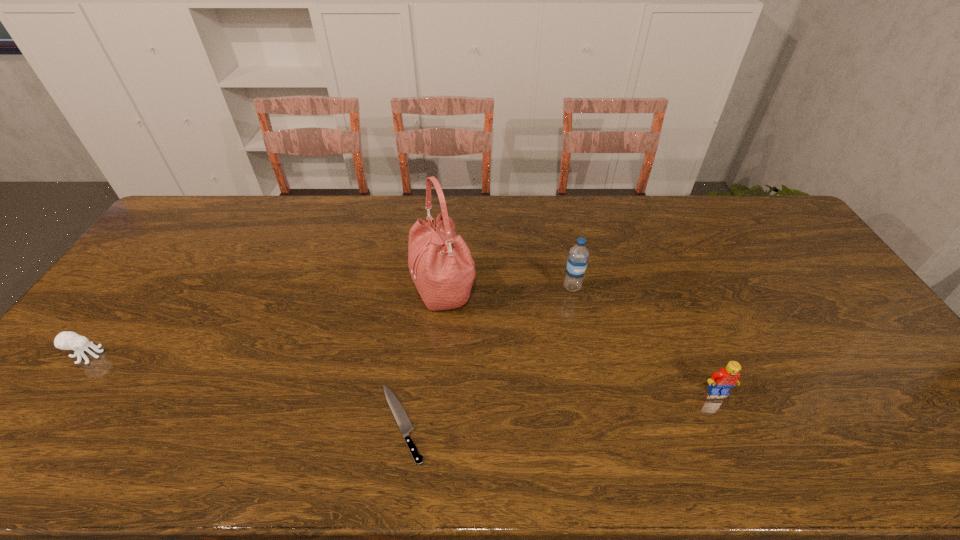
Locate an element on the screen. handbag is located at coordinates (441, 266).

Find the location of `the fourth shortest object`. the fourth shortest object is located at coordinates (578, 257).

Locate an element on the screen. Image resolution: width=960 pixels, height=540 pixels. water bottle is located at coordinates (578, 257).

This screenshot has height=540, width=960. Identify the location of the third shortest object. (721, 381).

The width and height of the screenshot is (960, 540). I want to click on Lego, so click(721, 381).

You are a GUI agent. You are given a task and a screenshot of the screen. Output one action in this format:
    pyautogui.click(x=<x>, y=<y>)
    Task: Click on the fourth tallest object
    Image resolution: width=960 pixels, height=540 pixels.
    Given the screenshot: What is the action you would take?
    click(x=67, y=340)

At what (x,y) coordinates should I click in order to perform the action: click on octopus. Please return your answer as a coordinate pair (x, y). Looking at the image, I should click on (67, 340).

In order to click on steak knife in this screenshot , I will do `click(402, 419)`.

Locate an element on the screen. This screenshot has height=540, width=960. vacant space located on the right of the tallest object is located at coordinates (506, 289).

Find the location of a particular element. The width and height of the screenshot is (960, 540). free space located on the label of the fourth object from left to right is located at coordinates (576, 306).